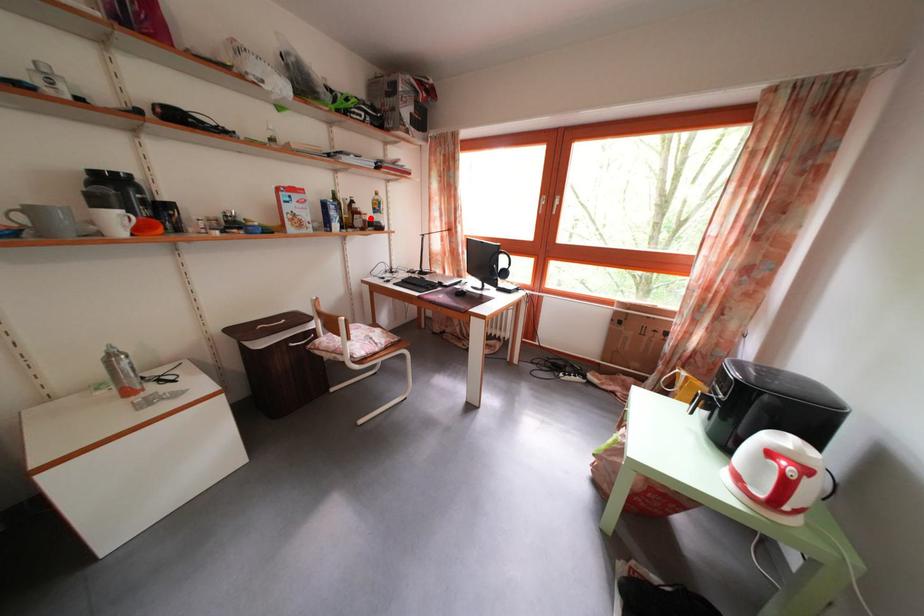
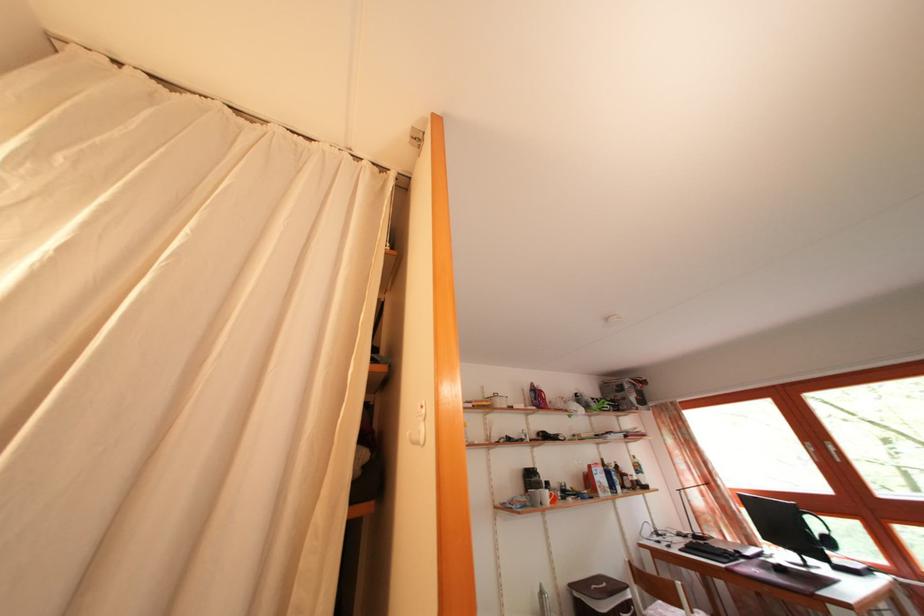
The point at the highlighted location is marked in the first image. Where is the corresponding point in the second image?

(636, 480)